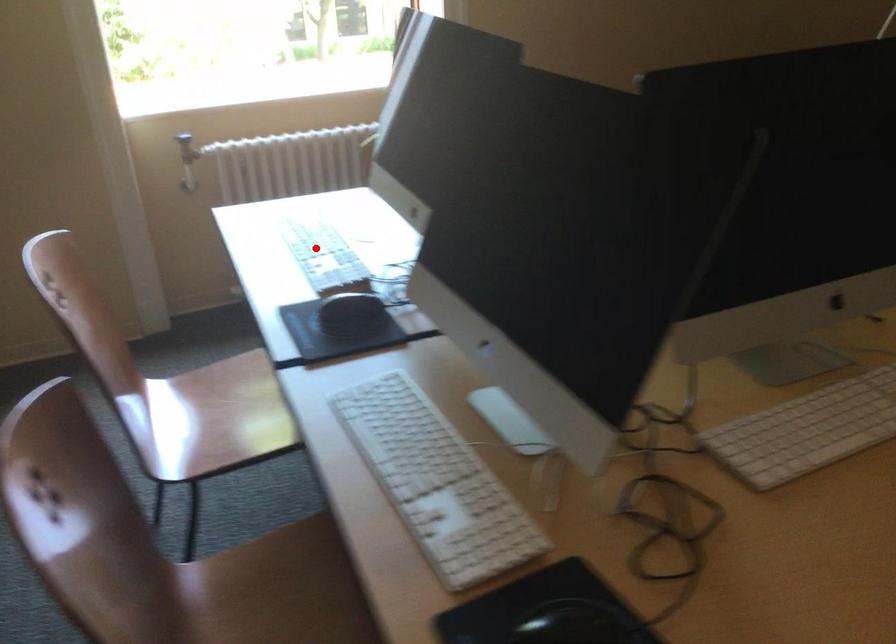
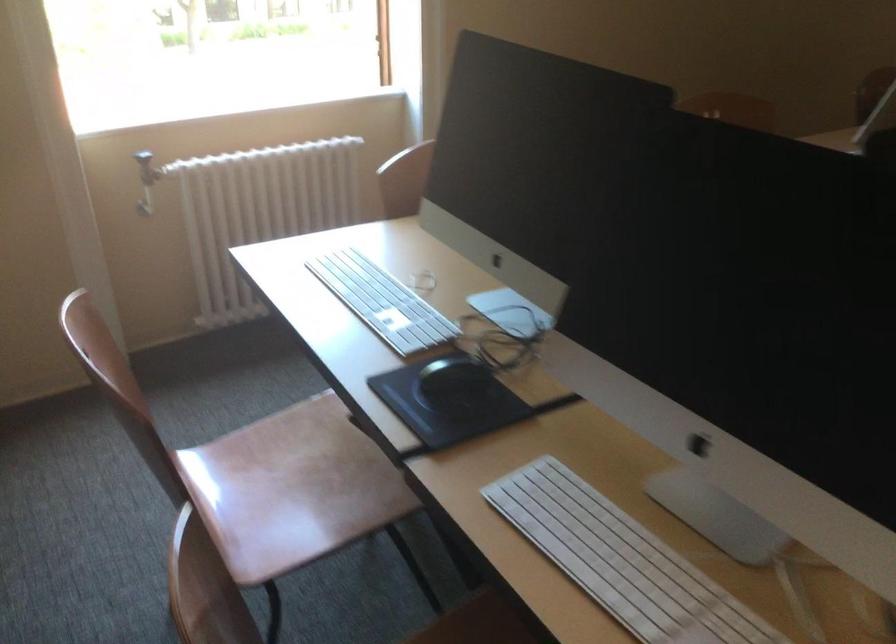
Question: I am providing you with two images of the same scene from different viewpoints. Image1 has a red point marked. In image2, the corresponding 3D location appears at what relative position? Reply with the corresponding letter.

Choices:
 (A) Closer
 (B) Farther

Answer: (A)